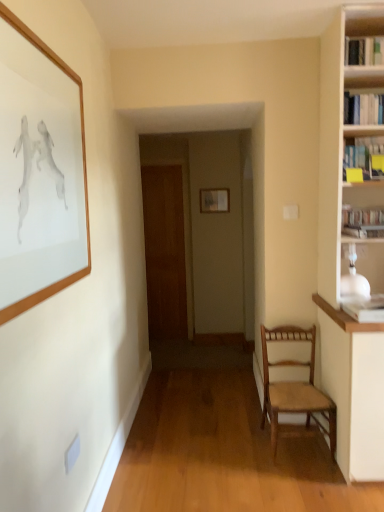
The height and width of the screenshot is (512, 384). In order to click on wooden picture frame at center, acting as the 1th picture frame starting from the right in this screenshot , I will do `click(215, 200)`.

The image size is (384, 512). Describe the element at coordinates (215, 200) in the screenshot. I see `wooden picture frame at center, which is counted as the first picture frame, starting from the back` at that location.

At what (x,y) coordinates should I click in order to perform the action: click on wooden picture frame at upper left, positioned as the 2th picture frame in back-to-front order. Please return your answer as a coordinate pair (x, y). Looking at the image, I should click on (39, 170).

Where is `yellow paper at upper right, which is counted as the 3th book, starting from the top`? yellow paper at upper right, which is counted as the 3th book, starting from the top is located at coordinates (363, 155).

The height and width of the screenshot is (512, 384). I want to click on hardcover book at right, placed as the fourth book when sorted from top to bottom, so click(x=362, y=216).

Identify the location of hardcover book at upper right, positioned as the first book in top-to-bottom order. (364, 51).

You are a GUI agent. You are given a task and a screenshot of the screen. Output one action in this format:
    pyautogui.click(x=<x>, y=<y>)
    Task: Click on the wooden picture frame at center, which is counted as the first picture frame, starting from the back
    The image size is (384, 512).
    Given the screenshot: What is the action you would take?
    pyautogui.click(x=215, y=200)

From a real-world perspective, is hardcover book at right, which appears as the 1th book when ordered from the bottom, over yellow paper at upper right, which is the second book in bottom-to-top order?

Incorrect, from a real-world perspective, hardcover book at right, which appears as the 1th book when ordered from the bottom, is lower than yellow paper at upper right, which is the second book in bottom-to-top order.

Is hardcover book at right, which appears as the 1th book when ordered from the bottom, located outside yellow paper at upper right, which is counted as the 3th book, starting from the top?

Yes, hardcover book at right, which appears as the 1th book when ordered from the bottom, is located beyond the bounds of yellow paper at upper right, which is counted as the 3th book, starting from the top.

Are hardcover book at right, which appears as the 1th book when ordered from the bottom, and yellow paper at upper right, which is the second book in bottom-to-top order, located far from each other?

No, hardcover book at right, which appears as the 1th book when ordered from the bottom, is not far away from yellow paper at upper right, which is the second book in bottom-to-top order.

Does hardcover book at right, placed as the fourth book when sorted from top to bottom, have a lesser height compared to wooden picture frame at upper left, placed as the first picture frame when sorted from left to right?

Yes.

Is wooden picture frame at upper left, placed as the first picture frame when sorted from left to right, at the back of hardcover book at right, which appears as the 1th book when ordered from the bottom?

No.

Is the position of hardcover book at right, which appears as the 1th book when ordered from the bottom, less distant than that of wooden picture frame at upper left, placed as the first picture frame when sorted from left to right?

No, it is behind wooden picture frame at upper left, placed as the first picture frame when sorted from left to right.

Which is in front, point (348, 223) or point (20, 199)?

The point (20, 199) is in front.

Between point (176, 282) and point (263, 358), which one is positioned behind?

The point (176, 282) is farther from the camera.

Is brown wooden door at center aimed at wooden woven seat chair at lower right?

No.

Is brown wooden door at center taller or shorter than wooden woven seat chair at lower right?

Considering their sizes, brown wooden door at center has more height than wooden woven seat chair at lower right.

Does brown wooden door at center have a lesser width compared to wooden woven seat chair at lower right?

Indeed, brown wooden door at center has a lesser width compared to wooden woven seat chair at lower right.

Is hardcover book at upper right, which is counted as the 3th book, starting from the bottom, taller than brown wooden door at center?

Incorrect, the height of hardcover book at upper right, which is counted as the 3th book, starting from the bottom, is not larger of that of brown wooden door at center.

Between hardcover book at upper right, arranged as the second book when viewed from the top, and brown wooden door at center, which one has smaller size?

With smaller size is hardcover book at upper right, arranged as the second book when viewed from the top.

Is hardcover book at upper right, arranged as the second book when viewed from the top, positioned before brown wooden door at center?

Yes, it is in front of brown wooden door at center.

Are brown wooden door at center and wooden picture frame at upper left, which is the second picture frame from right to left, far apart?

Yes, brown wooden door at center and wooden picture frame at upper left, which is the second picture frame from right to left, are quite far apart.

Can you confirm if brown wooden door at center is thinner than wooden picture frame at upper left, positioned as the 2th picture frame in back-to-front order?

Incorrect, the width of brown wooden door at center is not less than that of wooden picture frame at upper left, positioned as the 2th picture frame in back-to-front order.

Between brown wooden door at center and wooden picture frame at upper left, which is the second picture frame from right to left, which one has more height?

brown wooden door at center.

The image size is (384, 512). In order to click on door directly beneath the wooden picture frame at upper left, positioned as the 2th picture frame in back-to-front order (from a real-world perspective) in this screenshot , I will do `click(164, 251)`.

Does wooden picture frame at upper left, placed as the first picture frame when sorted from left to right, have a greater height compared to brown wooden door at center?

No.

From the image's perspective, is wooden picture frame at upper left, the first picture frame viewed from the front, below brown wooden door at center?

Actually, wooden picture frame at upper left, the first picture frame viewed from the front, appears above brown wooden door at center in the image.

Is wooden picture frame at upper left, placed as the first picture frame when sorted from left to right, looking in the opposite direction of brown wooden door at center?

No, brown wooden door at center is not at the back of wooden picture frame at upper left, placed as the first picture frame when sorted from left to right.

From a real-world perspective, is wooden woven seat chair at lower right under brown wooden door at center?

Indeed, from a real-world perspective, wooden woven seat chair at lower right is positioned beneath brown wooden door at center.

Between wooden woven seat chair at lower right and brown wooden door at center, which one is positioned in front?

wooden woven seat chair at lower right is closer to the camera.

Is there a large distance between wooden woven seat chair at lower right and brown wooden door at center?

Indeed, wooden woven seat chair at lower right is not near brown wooden door at center.

This screenshot has width=384, height=512. What are the coordinates of `chair below the brown wooden door at center (from a real-world perspective)` in the screenshot? It's located at (294, 387).

Image resolution: width=384 pixels, height=512 pixels. In the image, there is a yellow paper at upper right, which is the second book in bottom-to-top order. Identify the location of book below it (from the image's perspective). (362, 216).

Starting from the wooden picture frame at upper left, which is the second picture frame from right to left, which book is the 4th one behind? Please provide its 2D coordinates.

[(362, 216)]

From the image, which object appears to be nearer to hardcover book at upper right, which is the fourth book from bottom to top, wooden picture frame at center, arranged as the second picture frame when viewed from the left, or hardcover book at upper right, which is counted as the 3th book, starting from the bottom?

hardcover book at upper right, which is counted as the 3th book, starting from the bottom, is positioned closer to the anchor hardcover book at upper right, which is the fourth book from bottom to top.

Estimate the real-world distances between objects in this image. Which object is further from wooden picture frame at upper left, placed as the first picture frame when sorted from left to right, hardcover book at right, which appears as the 1th book when ordered from the bottom, or brown wooden door at center?

brown wooden door at center lies further to wooden picture frame at upper left, placed as the first picture frame when sorted from left to right, than the other object.

Which object lies further to the anchor point brown wooden door at center, hardcover book at right, placed as the fourth book when sorted from top to bottom, or wooden picture frame at upper left, the first picture frame viewed from the front?

Among the two, wooden picture frame at upper left, the first picture frame viewed from the front, is located further to brown wooden door at center.

Estimate the real-world distances between objects in this image. Which object is further from wooden picture frame at center, arranged as the second picture frame when viewed from the left, hardcover book at upper right, which is the fourth book from bottom to top, or hardcover book at upper right, which is counted as the 3th book, starting from the bottom?

hardcover book at upper right, which is the fourth book from bottom to top.

Looking at this image, from the image, which object appears to be nearer to wooden picture frame at center, which is counted as the second picture frame, starting from the front, hardcover book at upper right, which is the fourth book from bottom to top, or yellow paper at upper right, which is counted as the 3th book, starting from the top?

Among the two, yellow paper at upper right, which is counted as the 3th book, starting from the top, is located nearer to wooden picture frame at center, which is counted as the second picture frame, starting from the front.

Estimate the real-world distances between objects in this image. Which object is further from wooden picture frame at center, which is counted as the second picture frame, starting from the front, hardcover book at upper right, arranged as the second book when viewed from the top, or wooden picture frame at upper left, which is the second picture frame from right to left?

wooden picture frame at upper left, which is the second picture frame from right to left, is further to wooden picture frame at center, which is counted as the second picture frame, starting from the front.

In the scene shown: Estimate the real-world distances between objects in this image. Which object is closer to hardcover book at upper right, positioned as the first book in top-to-bottom order, wooden picture frame at upper left, which is the second picture frame from right to left, or hardcover book at right, placed as the fourth book when sorted from top to bottom?

hardcover book at right, placed as the fourth book when sorted from top to bottom, lies closer to hardcover book at upper right, positioned as the first book in top-to-bottom order, than the other object.

Based on their spatial positions, is yellow paper at upper right, which is counted as the 3th book, starting from the top, or wooden picture frame at center, which is counted as the first picture frame, starting from the back, closer to wooden woven seat chair at lower right?

yellow paper at upper right, which is counted as the 3th book, starting from the top, is positioned closer to the anchor wooden woven seat chair at lower right.

Identify the location of book between yellow paper at upper right, which is counted as the 3th book, starting from the top, and wooden woven seat chair at lower right vertically. The height and width of the screenshot is (512, 384). (362, 216).

Where is `chair located between wooden picture frame at upper left, placed as the first picture frame when sorted from left to right, and brown wooden door at center in the depth direction`? The height and width of the screenshot is (512, 384). chair located between wooden picture frame at upper left, placed as the first picture frame when sorted from left to right, and brown wooden door at center in the depth direction is located at coordinates (294, 387).

At what (x,y) coordinates should I click in order to perform the action: click on picture frame between hardcover book at right, placed as the fourth book when sorted from top to bottom, and brown wooden door at center from front to back. Please return your answer as a coordinate pair (x, y). Image resolution: width=384 pixels, height=512 pixels. Looking at the image, I should click on (215, 200).

At what (x,y) coordinates should I click in order to perform the action: click on book between yellow paper at upper right, which is counted as the 3th book, starting from the top, and wooden picture frame at center, arranged as the second picture frame when viewed from the left, along the z-axis. Please return your answer as a coordinate pair (x, y). The image size is (384, 512). Looking at the image, I should click on (362, 216).